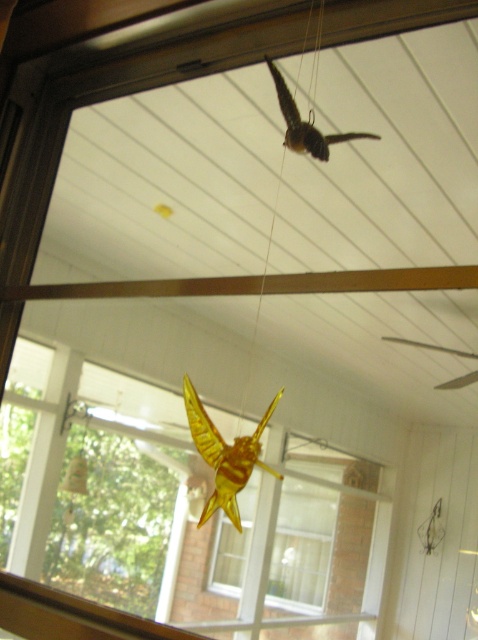
Can you confirm if brown wooden beam at center is thinner than brown matte bird at upper center?

No.

Is point (433, 276) farther from viewer compared to point (286, 136)?

No, (433, 276) is in front of (286, 136).

Which is in front, point (369, 273) or point (274, 86)?

Point (369, 273)

This screenshot has height=640, width=478. Identify the location of brown wooden beam at center. (259, 284).

Who is lower down, brown matte bird at upper center or translucent yellow insect at upper center?

translucent yellow insect at upper center

Image resolution: width=478 pixels, height=640 pixels. Identify the location of brown matte bird at upper center. (305, 124).

Where is `brown matte bird at upper center`? This screenshot has width=478, height=640. brown matte bird at upper center is located at coordinates (305, 124).

Is brown wooden beam at center to the left of translucent amber insect at center from the viewer's perspective?

Yes, brown wooden beam at center is to the left of translucent amber insect at center.

Does point (454, 268) come in front of point (214, 452)?

Yes, point (454, 268) is in front of point (214, 452).

Is point (312, 291) closer to viewer compared to point (253, 451)?

That is True.

At what (x,y) coordinates should I click in order to perform the action: click on brown wooden beam at center. Please return your answer as a coordinate pair (x, y). This screenshot has width=478, height=640. Looking at the image, I should click on (259, 284).